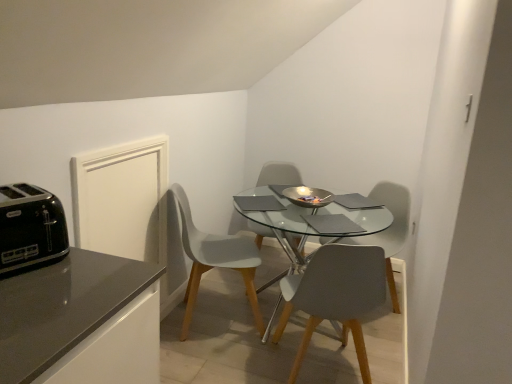
Locate an element on the screen. The height and width of the screenshot is (384, 512). free point to the left of matte gray chair at center, placed as the third chair when sorted from left to right is located at coordinates (226, 366).